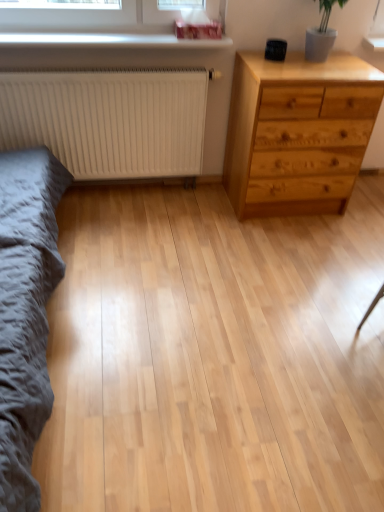
Locate an element on the screen. dark gray fabric bed frame at left is located at coordinates (26, 311).

What do you see at coordinates (26, 311) in the screenshot? I see `dark gray fabric bed frame at left` at bounding box center [26, 311].

Measure the distance between point (343, 172) and camera.

Point (343, 172) and camera are 7.84 feet apart from each other.

Locate an element on the screen. dark gray fabric bed frame at left is located at coordinates 26,311.

Would you say white matte radiator at left is a long distance from white glossy window sill at upper center?

No.

Does point (118, 140) come in front of point (87, 44)?

No, (118, 140) is further to viewer.

Between white matte radiator at left and white glossy window sill at upper center, which one appears on the right side from the viewer's perspective?

Positioned to the right is white glossy window sill at upper center.

Is white matte radiator at left closer to the viewer compared to white glossy window sill at upper center?

No, white matte radiator at left is further to the viewer.

From the picture: Between white glossy window sill at upper center and white matte radiator at left, which one appears on the left side from the viewer's perspective?

From the viewer's perspective, white matte radiator at left appears more on the left side.

How many degrees apart are the facing directions of white glossy window sill at upper center and white matte radiator at left?

The angular difference between white glossy window sill at upper center and white matte radiator at left is 0.545 degrees.

In the scene shown: From a real-world perspective, does white glossy window sill at upper center sit lower than white matte radiator at left?

No, from a real-world perspective, white glossy window sill at upper center is not under white matte radiator at left.

Is white glossy window sill at upper center far away from white matte radiator at left?

white glossy window sill at upper center is actually quite close to white matte radiator at left.

Could natural wood chest of drawers at right be considered to be inside white glossy window sill at upper center?

No, natural wood chest of drawers at right is located outside of white glossy window sill at upper center.

From the picture: From a real-world perspective, is white glossy window sill at upper center above or below natural wood chest of drawers at right?

Clearly, from a real-world perspective, white glossy window sill at upper center is above natural wood chest of drawers at right.

Is white glossy window sill at upper center in front of or behind natural wood chest of drawers at right in the image?

Clearly, white glossy window sill at upper center is behind natural wood chest of drawers at right.

Locate an element on the screen. The width and height of the screenshot is (384, 512). window sill above the dark gray fabric bed frame at left (from a real-world perspective) is located at coordinates (110, 41).

From the image's perspective, between dark gray fabric bed frame at left and white glossy window sill at upper center, who is located below?

dark gray fabric bed frame at left is shown below in the image.

Could you tell me if dark gray fabric bed frame at left is facing white glossy window sill at upper center?

Yes, dark gray fabric bed frame at left is oriented towards white glossy window sill at upper center.

Can you tell me how much white matte radiator at left and dark gray fabric bed frame at left differ in facing direction?

90.8 degrees.

Considering the positions of objects white matte radiator at left and dark gray fabric bed frame at left in the image provided, who is more to the right, white matte radiator at left or dark gray fabric bed frame at left?

white matte radiator at left.

Which is less distant, (76,159) or (1,490)?

Point (76,159) is farther from the camera than point (1,490).

Can you see natural wood chest of drawers at right touching white glossy window sill at upper center?

No, natural wood chest of drawers at right is not in contact with white glossy window sill at upper center.

Consider the image. Is natural wood chest of drawers at right completely or partially outside of white glossy window sill at upper center?

natural wood chest of drawers at right is positioned outside white glossy window sill at upper center.

What are the coordinates of `chest of drawers in front of the white glossy window sill at upper center` in the screenshot? It's located at (298, 132).

From a real-world perspective, is natural wood chest of drawers at right physically above white glossy window sill at upper center?

No, from a real-world perspective, natural wood chest of drawers at right is not on top of white glossy window sill at upper center.

Considering the sizes of white matte radiator at left and natural wood chest of drawers at right in the image, is white matte radiator at left wider or thinner than natural wood chest of drawers at right?

Considering their sizes, white matte radiator at left looks slimmer than natural wood chest of drawers at right.

Considering their positions, is white matte radiator at left located in front of or behind natural wood chest of drawers at right?

Visually, white matte radiator at left is located behind natural wood chest of drawers at right.

From a real-world perspective, is white matte radiator at left positioned over natural wood chest of drawers at right based on gravity?

No, from a real-world perspective, white matte radiator at left is not on top of natural wood chest of drawers at right.

Identify the location of window sill above the white matte radiator at left (from a real-world perspective). This screenshot has height=512, width=384. (110, 41).

In order to click on radiator that is below the white glossy window sill at upper center (from the image's perspective) in this screenshot , I will do point(109,120).

When comparing their distances from white matte radiator at left, does dark gray fabric bed frame at left or white glossy window sill at upper center seem closer?

Among the two, white glossy window sill at upper center is located nearer to white matte radiator at left.

Considering their positions, is white matte radiator at left positioned further to white glossy window sill at upper center than natural wood chest of drawers at right?

Based on the image, natural wood chest of drawers at right appears to be further to white glossy window sill at upper center.

Considering their positions, is natural wood chest of drawers at right positioned further to white matte radiator at left than dark gray fabric bed frame at left?

natural wood chest of drawers at right lies further to white matte radiator at left than the other object.

From the image, which object appears to be nearer to white matte radiator at left, white glossy window sill at upper center or natural wood chest of drawers at right?

The object closer to white matte radiator at left is white glossy window sill at upper center.

Based on their spatial positions, is dark gray fabric bed frame at left or white glossy window sill at upper center closer to natural wood chest of drawers at right?

white glossy window sill at upper center lies closer to natural wood chest of drawers at right than the other object.

Estimate the real-world distances between objects in this image. Which object is further from natural wood chest of drawers at right, white matte radiator at left or white glossy window sill at upper center?

white glossy window sill at upper center.

Based on their spatial positions, is natural wood chest of drawers at right or white matte radiator at left further from dark gray fabric bed frame at left?

natural wood chest of drawers at right lies further to dark gray fabric bed frame at left than the other object.

Looking at the image, which one is located further to white glossy window sill at upper center, natural wood chest of drawers at right or dark gray fabric bed frame at left?

The object further to white glossy window sill at upper center is dark gray fabric bed frame at left.

You are a GUI agent. You are given a task and a screenshot of the screen. Output one action in this format:
    pyautogui.click(x=<x>, y=<y>)
    Task: Click on the chest of drawers between dark gray fabric bed frame at left and white glossy window sill at upper center in the front-back direction
    This screenshot has width=384, height=512.
    Given the screenshot: What is the action you would take?
    pyautogui.click(x=298, y=132)

Locate an element on the screen. the chest of drawers positioned between dark gray fabric bed frame at left and white matte radiator at left from near to far is located at coordinates (298, 132).

This screenshot has width=384, height=512. Find the location of `window sill between white matte radiator at left and natural wood chest of drawers at right in the horizontal direction`. window sill between white matte radiator at left and natural wood chest of drawers at right in the horizontal direction is located at coordinates (110, 41).

I want to click on window sill between dark gray fabric bed frame at left and white matte radiator at left in the front-back direction, so click(x=110, y=41).